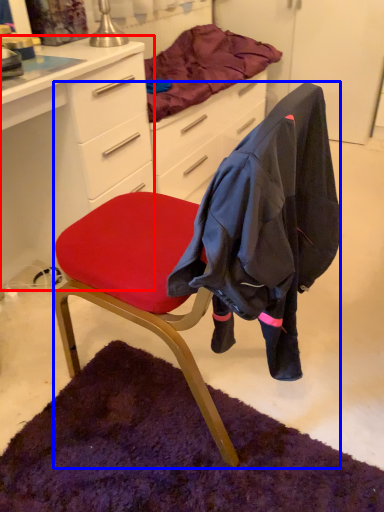
Question: Which point is closer to the camera, desk (highlighted by a red box) or chair (highlighted by a blue box)?

Choices:
 (A) desk
 (B) chair

Answer: (B)